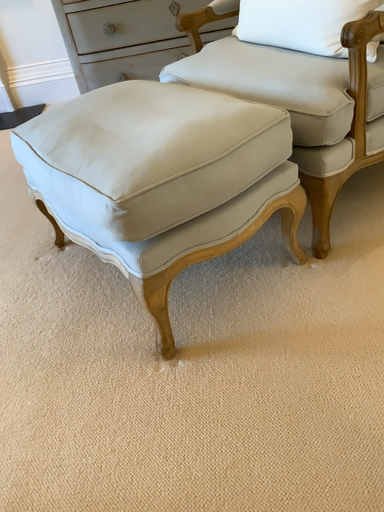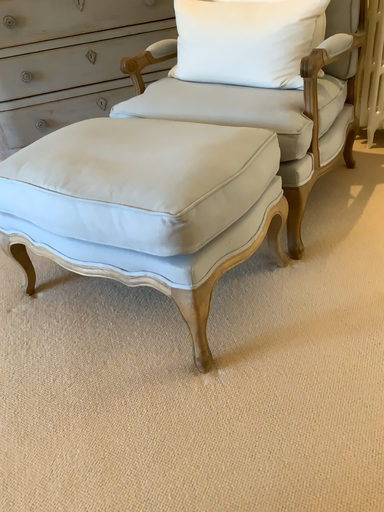
Question: How did the camera likely rotate when shooting the video?

Choices:
 (A) rotated left
 (B) rotated right

Answer: (B)